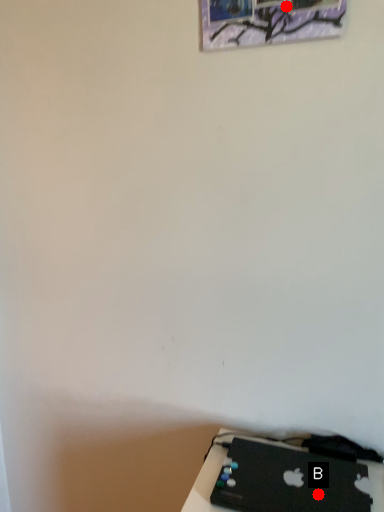
Question: Two points are circled on the image, labeled by A and B beside each circle. Which point appears farthest from the camera in this image?

Choices:
 (A) A is further
 (B) B is further

Answer: (B)